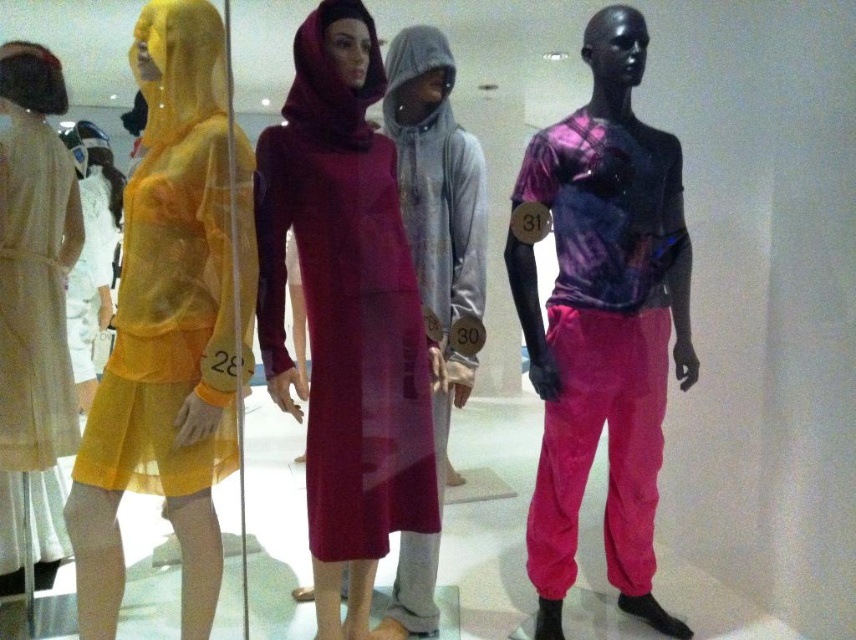
You are a customer in a clothing store and want to try on the gray fleece hoodie at center. You see the gray fleece hoodie at center is displayed at point (437, 177). Is the gray fleece hoodie at center closer to the foreground mannequin on the right or the background mannequin on the left?

The gray fleece hoodie at center is closer to the foreground mannequin on the right because it is displayed at point (437, 177), which is closer to the foreground mannequin on the right than the background mannequin on the left.

You are a customer in a clothing store looking at the display. You see the translucent yellow dress at left and the velvet burgundy dress at center. Which dress is covering part of the other one?

The translucent yellow dress at left is positioned over the velvet burgundy dress at center, so it is covering part of the velvet burgundy dress at center.

From the picture: You are a fashion designer trying to decide which dress to feature in a magazine layout. The layout requires a dress that is wider than the other. Which dress should you choose between the translucent yellow dress at left and the velvet burgundy dress at center?

The translucent yellow dress at left is wider than the velvet burgundy dress at center, so you should choose the translucent yellow dress at left for the magazine layout.